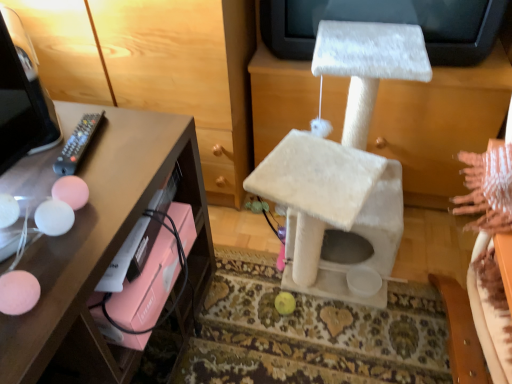
Question: From a real-world perspective, is matte pink drawer at left physically located above or below white furry cat tree at center?

Choices:
 (A) below
 (B) above

Answer: (B)

Question: Would you say matte pink drawer at left is to the left or to the right of white furry cat tree at center in the picture?

Choices:
 (A) right
 (B) left

Answer: (B)

Question: Estimate the real-world distances between objects in this image. Which object is closer to the white furry cat tree at center?

Choices:
 (A) matte pink drawer at left
 (B) black plastic remote at left

Answer: (A)

Question: Based on their relative distances, which object is nearer to the white furry cat tree at center?

Choices:
 (A) black plastic remote at left
 (B) matte pink drawer at left

Answer: (B)